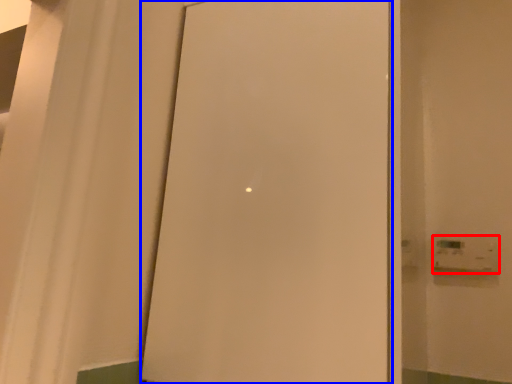
Question: Which of the following is the farthest to the observer, light switch (highlighted by a red box) or door (highlighted by a blue box)?

Choices:
 (A) light switch
 (B) door

Answer: (A)